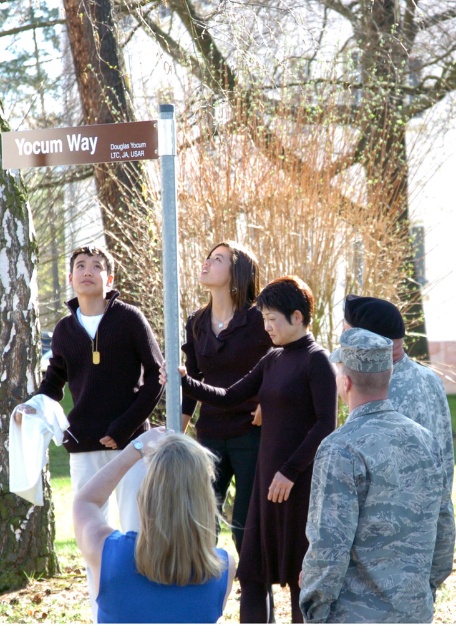
You are standing at the origin point of the coordinate system in the image. Where is the camouflage uniform at right located in terms of coordinates?

The camouflage uniform at right is located at coordinates point (373, 502).